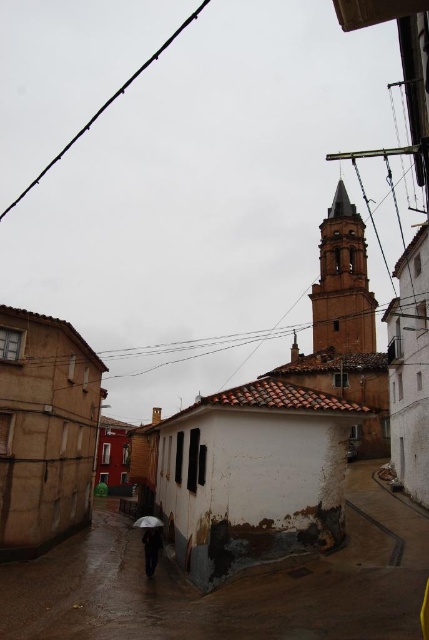
Which is below, dark fabric umbrella at lower center or white matte umbrella at lower center?

white matte umbrella at lower center

The height and width of the screenshot is (640, 429). I want to click on dark fabric umbrella at lower center, so click(151, 548).

This screenshot has width=429, height=640. I want to click on dark fabric umbrella at lower center, so click(x=151, y=548).

Does point (60, 605) come farther from viewer compared to point (154, 547)?

No.

Between point (90, 538) and point (160, 532), which one is positioned in front?

Point (160, 532) is more forward.

Does point (117, 580) come behind point (151, 557)?

No.

You are a GUI agent. You are given a task and a screenshot of the screen. Output one action in this format:
    pyautogui.click(x=<x>, y=<y>)
    Task: Click on the rusty concrete alley at lower center
    The width and height of the screenshot is (429, 640).
    Given the screenshot: What is the action you would take?
    pyautogui.click(x=229, y=584)

Is rusty concrete alley at lower center to the left of white matte umbrella at lower center from the viewer's perspective?

Incorrect, rusty concrete alley at lower center is not on the left side of white matte umbrella at lower center.

From the picture: How far apart are rusty concrete alley at lower center and white matte umbrella at lower center?

They are 9.98 meters apart.

The image size is (429, 640). I want to click on rusty concrete alley at lower center, so click(229, 584).

Where is `rusty concrete alley at lower center`? The width and height of the screenshot is (429, 640). rusty concrete alley at lower center is located at coordinates (229, 584).